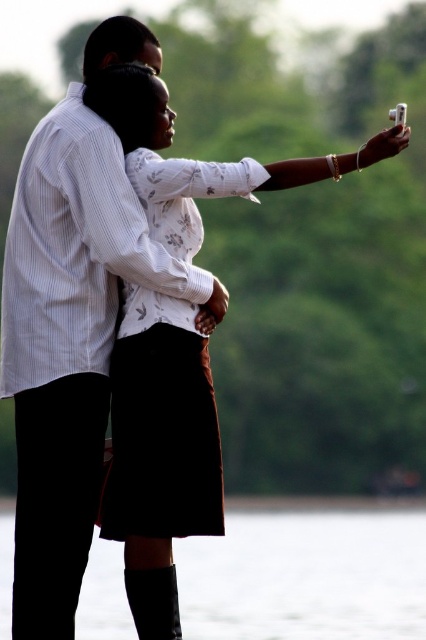
Question: Observing the image, what is the correct spatial positioning of black leather boots at lower center in reference to white floral blouse at upper center?

Choices:
 (A) below
 (B) above

Answer: (A)

Question: Among these objects, which one is farthest from the camera?

Choices:
 (A) white floral blouse at upper center
 (B) black leather boots at lower center

Answer: (B)

Question: Which object appears closest to the camera in this image?

Choices:
 (A) black leather boots at lower center
 (B) white floral blouse at upper center

Answer: (B)

Question: Can you confirm if black leather boots at lower center is positioned below white floral blouse at upper center?

Choices:
 (A) yes
 (B) no

Answer: (A)

Question: Which point is farther to the camera?

Choices:
 (A) (184, 582)
 (B) (129, 490)

Answer: (A)

Question: Is black leather boots at lower center in front of white floral blouse at upper center?

Choices:
 (A) no
 (B) yes

Answer: (A)